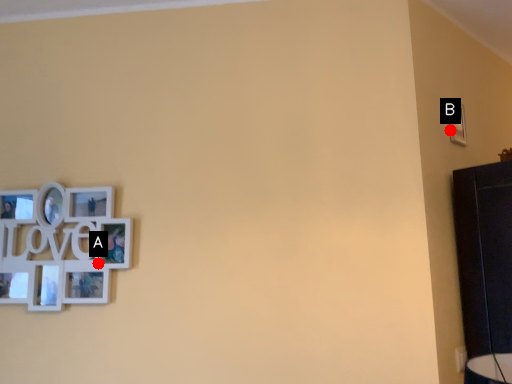
Question: Two points are circled on the image, labeled by A and B beside each circle. Which of the following is the farthest from the observer?

Choices:
 (A) A is further
 (B) B is further

Answer: (B)